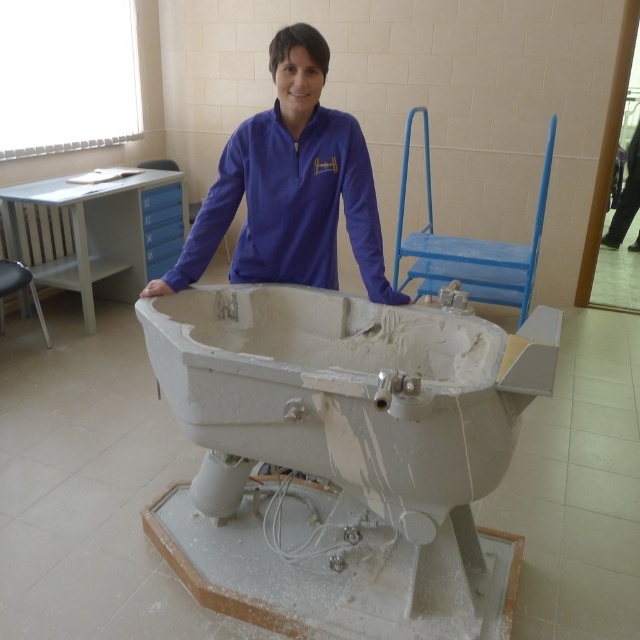
You are a technician in the lab and need to place both the white matte bathtub at center and the purple fleece at center into a storage container. The container can only hold one of them. Which object should you choose to fit inside?

The white matte bathtub at center has a larger size compared to purple fleece at center, so the purple fleece at center would fit into the storage container.

You are a technician in the lab and need to access the purple fleece at center. However, there is a white matte bathtub at center blocking your path. Can you move the bathtub to reach the fleece?

The white matte bathtub at center is in front of the purple fleece at center, meaning it is blocking the direct path. You will need to move the bathtub to access the purple fleece at center.

What object is located at the coordinates point [348,392] in the image?

The point [348,392] marks the white matte bathtub at center.